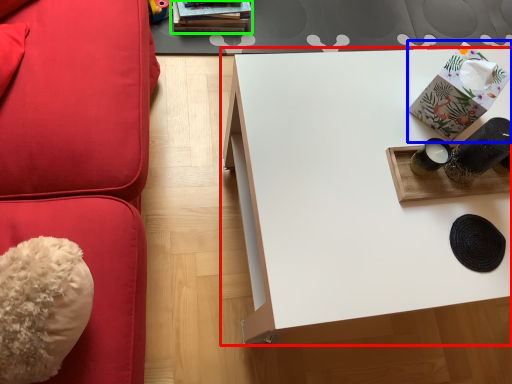
Question: Which is nearer to the table (highlighted by a red box)? package (highlighted by a blue box) or book (highlighted by a green box).

Choices:
 (A) package
 (B) book

Answer: (A)